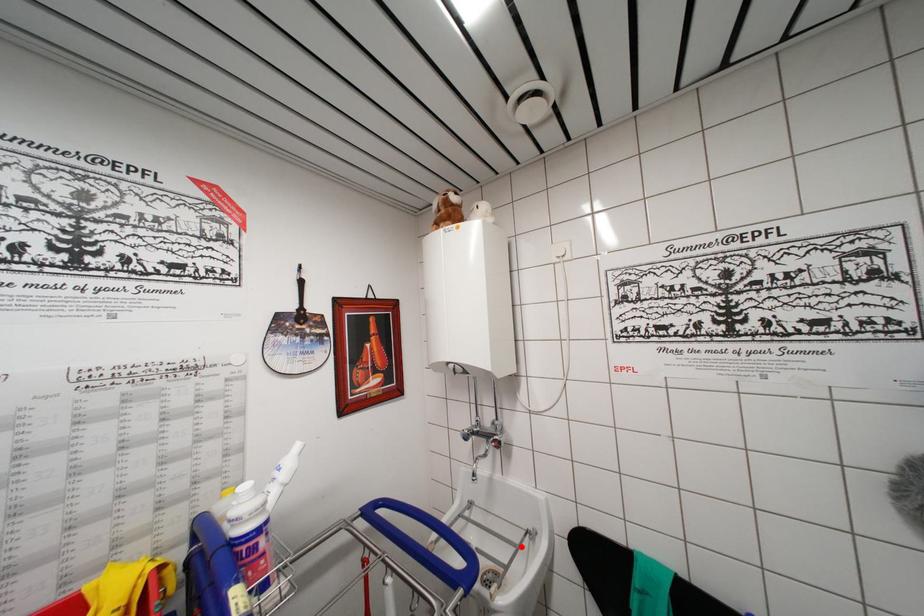
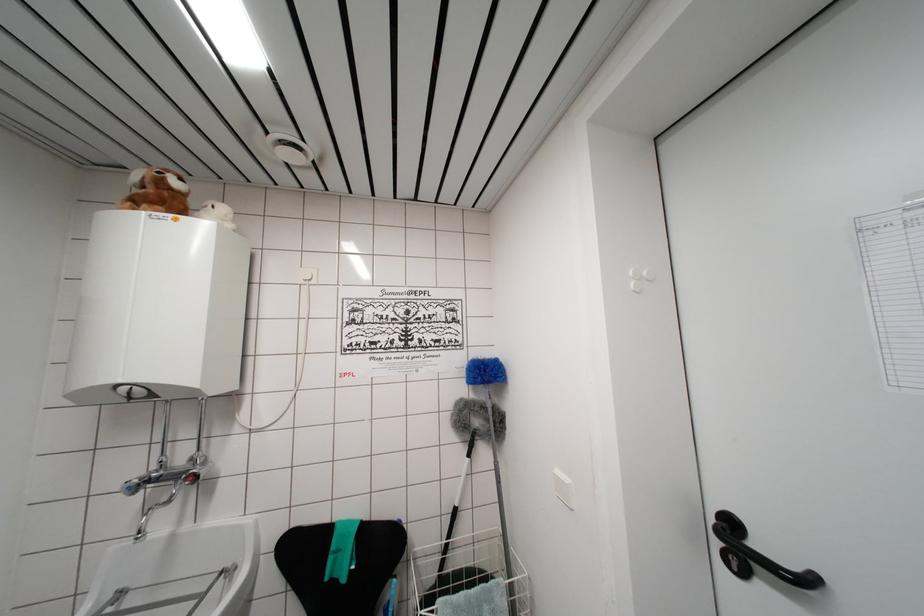
In the second image, find the point that corresponds to the highlighted location in the first image.

(209, 593)